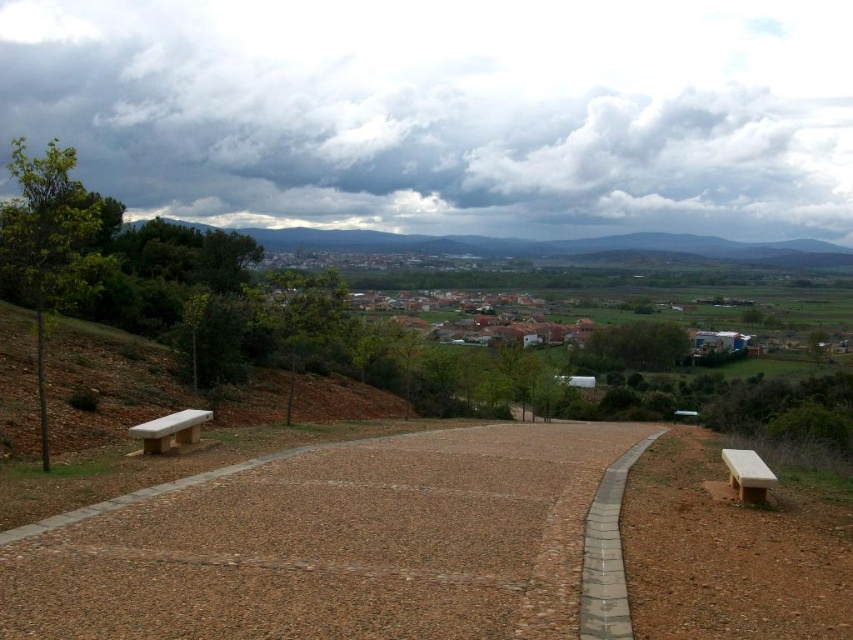
From the picture: Between brown gravel path at center and light brown wooden bench at right, which one is positioned lower?

brown gravel path at center

Is brown gravel path at center below light brown wooden bench at right?

Indeed, brown gravel path at center is positioned under light brown wooden bench at right.

Is point (558, 531) more distant than point (744, 486)?

No, (558, 531) is in front of (744, 486).

This screenshot has height=640, width=853. Find the location of `brown gravel path at center`. brown gravel path at center is located at coordinates (329, 544).

Between brown gravel path at center and white polished wood bench at lower left, which one is positioned higher?

white polished wood bench at lower left is above.

The width and height of the screenshot is (853, 640). Identify the location of brown gravel path at center. (329, 544).

Is point (401, 470) behind point (170, 220)?

No, it is in front of (170, 220).

Is brown gravel path at center above green grassy hillside at center?

No.

Which is in front, point (128, 518) or point (302, 240)?

Point (128, 518) is in front.

The image size is (853, 640). Identify the location of brown gravel path at center. (329, 544).